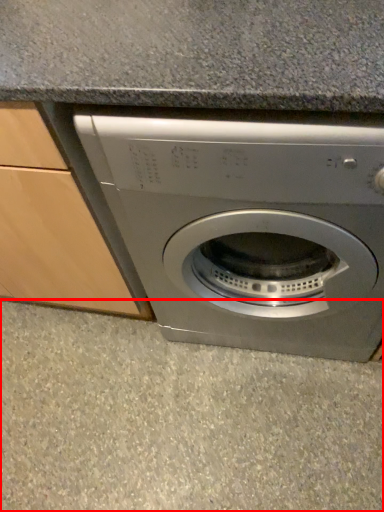
Question: From the image's perspective, considering the relative positions of concrete (annotated by the red box) and washing machine in the image provided, where is concrete (annotated by the red box) located with respect to the staircase?

Choices:
 (A) above
 (B) below

Answer: (B)